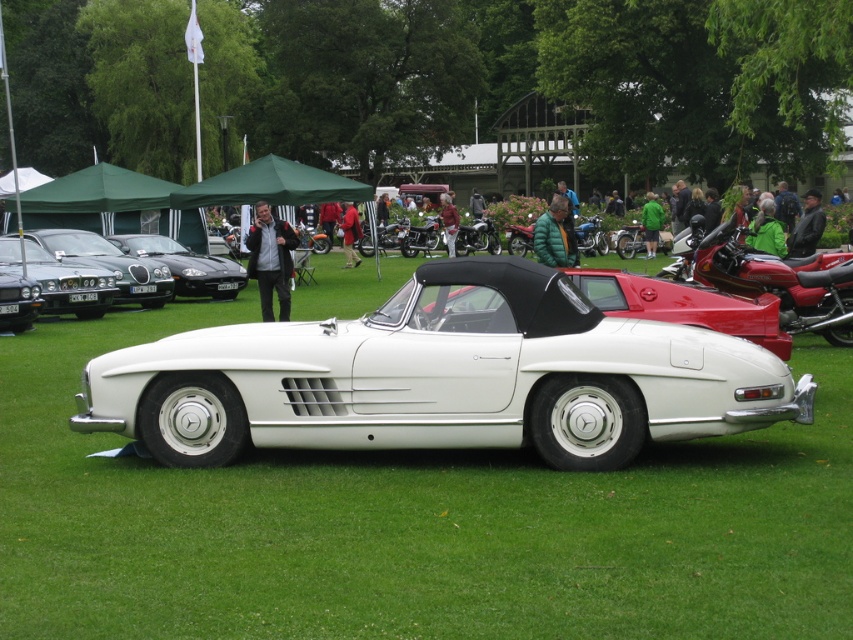
Question: Is shiny red motorcycle at right positioned at the back of shiny black car at center?

Choices:
 (A) no
 (B) yes

Answer: (A)

Question: Which object appears farthest from the camera in this image?

Choices:
 (A) shiny black car at center
 (B) white matte convertible at center

Answer: (A)

Question: Does white matte convertible at center have a larger size compared to shiny black car at center?

Choices:
 (A) no
 (B) yes

Answer: (A)

Question: Considering the real-world distances, which object is closest to the shiny black car at center?

Choices:
 (A) shiny black car at left
 (B) white matte convertible at center
 (C) shiny red motorcycle at right

Answer: (A)

Question: Among these objects, which one is nearest to the camera?

Choices:
 (A) shiny red motorcycle at right
 (B) white matte convertible at center
 (C) shiny black car at center
 (D) shiny black car at left

Answer: (B)

Question: Is white matte convertible at center positioned in front of shiny red motorcycle at right?

Choices:
 (A) yes
 (B) no

Answer: (A)